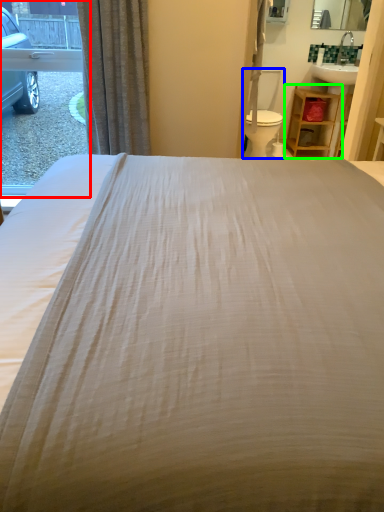
Question: Considering the real-world distances, which object is farthest from window (highlighted by a red box)? swivel chair (highlighted by a blue box) or furniture (highlighted by a green box)?

Choices:
 (A) swivel chair
 (B) furniture

Answer: (B)